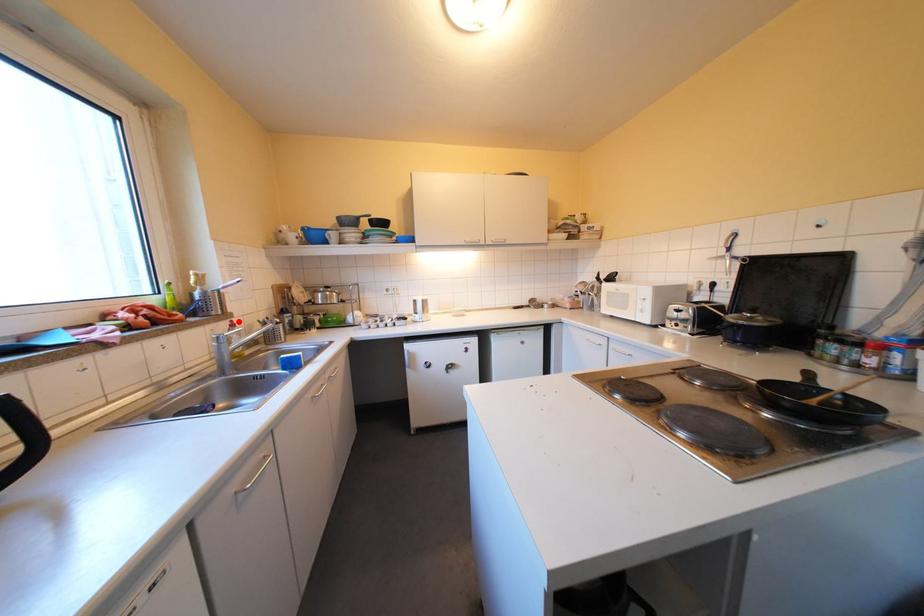
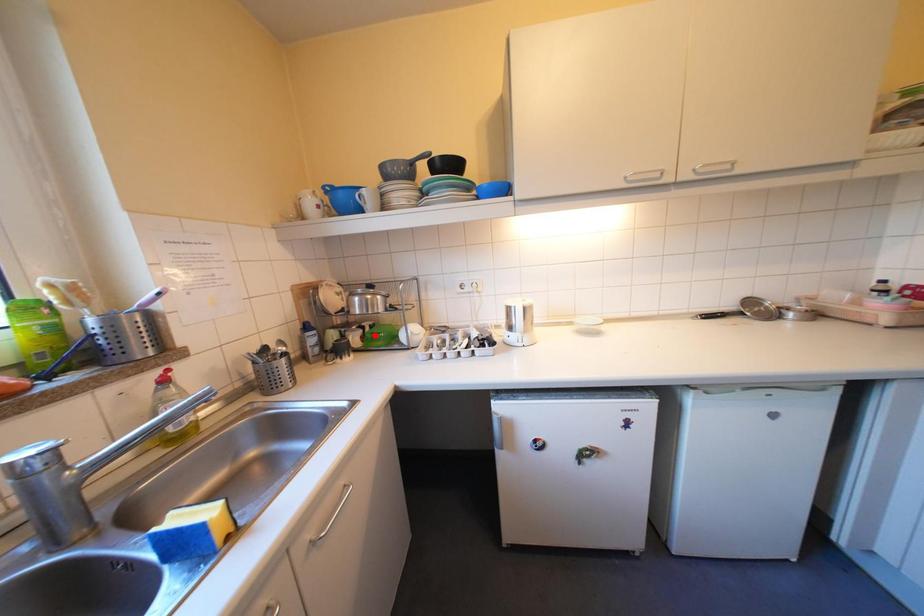
I am providing you with two images of the same scene from different viewpoints. A red point is marked on the first image and another point is marked on the second image. Is the marked point in image1 the same physical position as the marked point in image2?

No